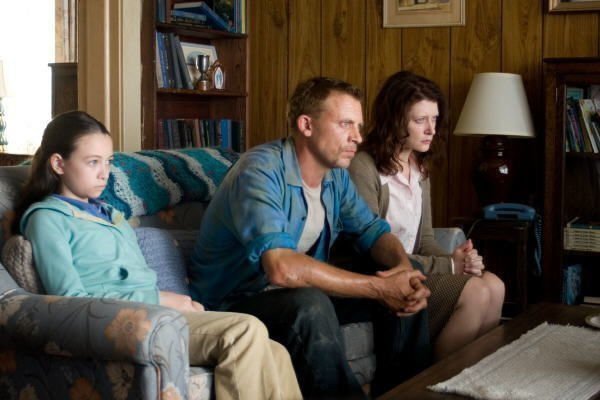
Identify the location of afghan blanket. This screenshot has width=600, height=400. (199, 183).